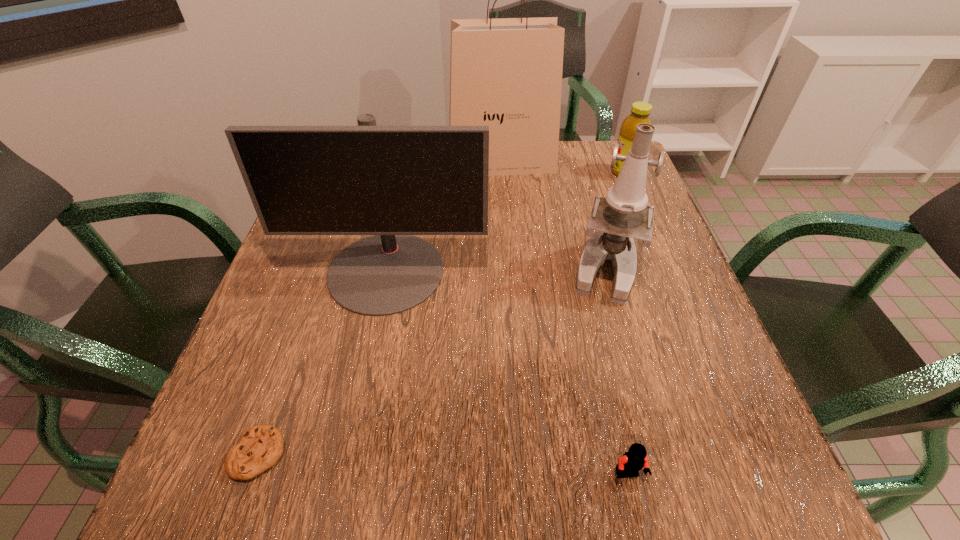
This screenshot has height=540, width=960. What are the coordinates of `the tallest object` in the screenshot? It's located at (506, 73).

At what (x,y) coordinates should I click in order to perform the action: click on microscope. Please return your answer as a coordinate pair (x, y). Looking at the image, I should click on coord(624,214).

This screenshot has height=540, width=960. I want to click on computer monitor, so click(x=392, y=182).

Find the location of a particular element. The image size is (960, 540). the rightmost object is located at coordinates (640, 111).

Locate an element on the screen. This screenshot has height=540, width=960. the third shortest object is located at coordinates click(x=640, y=111).

The image size is (960, 540). In order to click on Lego in this screenshot , I will do coord(632,461).

What are the coordinates of `the shortest object` in the screenshot? It's located at (261, 446).

Find the location of `blank space located 0.100m on the left of the shopping bag`. blank space located 0.100m on the left of the shopping bag is located at coordinates (x=414, y=163).

At what (x,y) coordinates should I click in order to perform the action: click on vacant region located on the front of the microscope. Please return your answer as a coordinate pair (x, y). The image size is (960, 540). Looking at the image, I should click on (645, 418).

You are a GUI agent. You are given a task and a screenshot of the screen. Output one action in this format:
    pyautogui.click(x=<x>, y=<y>)
    Task: Click on the free space located 0.170m on the screen of the computer monitor
    This screenshot has height=540, width=960.
    Given the screenshot: What is the action you would take?
    click(x=361, y=390)